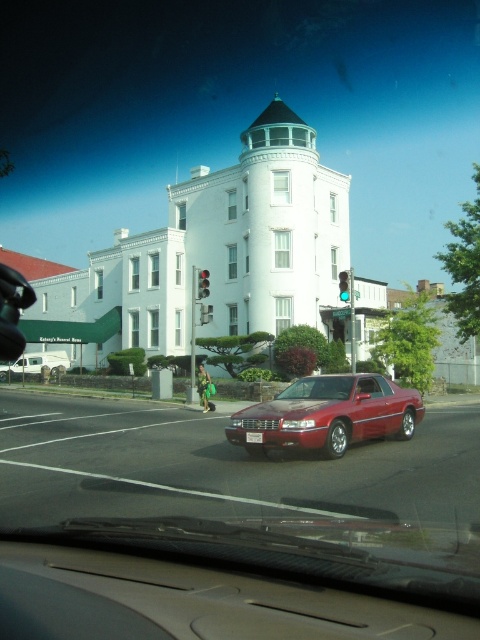
Question: Estimate the real-world distances between objects in this image. Which object is farther from the clear glass windshield at center?

Choices:
 (A) glossy red car at center
 (B) green glass traffic light at upper center
 (C) red glass traffic light at center
 (D) white matte van at left

Answer: (D)

Question: Among these points, which one is nearest to the camera?

Choices:
 (A) (54, 355)
 (B) (347, 282)
 (C) (296, 387)

Answer: (C)

Question: Which object is the closest to the green glass traffic light at upper center?

Choices:
 (A) red glass traffic light at center
 (B) glossy red car at center
 (C) white matte van at left

Answer: (A)

Question: Can you confirm if clear glass windshield at center is wider than green glass traffic light at upper center?

Choices:
 (A) no
 (B) yes

Answer: (A)

Question: In this image, where is clear glass windshield at center located relative to white matte van at left?

Choices:
 (A) above
 (B) below

Answer: (A)

Question: Can you confirm if clear glass windshield at center is smaller than green glass traffic light at upper center?

Choices:
 (A) no
 (B) yes

Answer: (B)